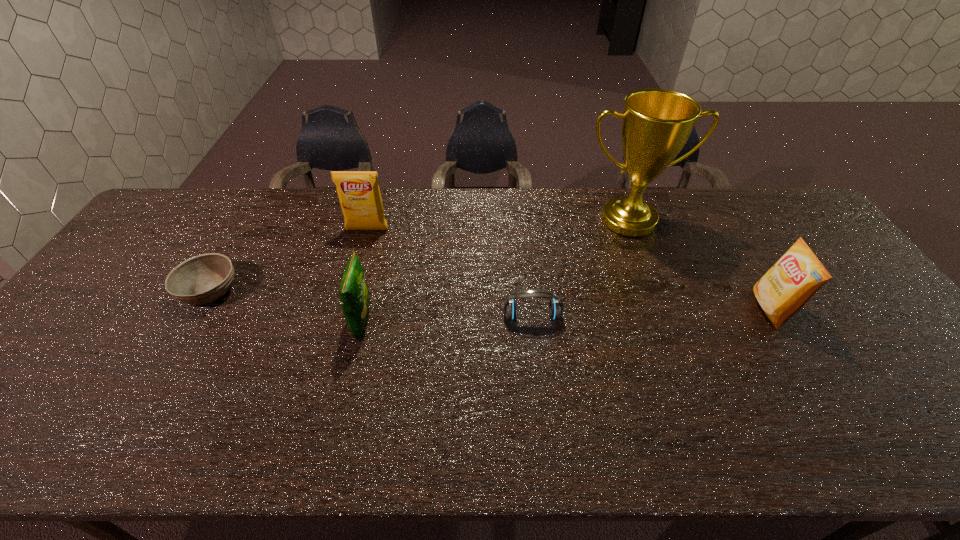
This screenshot has height=540, width=960. Identify the location of vacant space located on the front-facing side of the rightmost crisp (potato chip). (709, 309).

The image size is (960, 540). Identify the location of free space located on the front-facing side of the rightmost crisp (potato chip). (669, 309).

Identify the location of blank space located on the front-facing side of the rightmost crisp (potato chip). (606, 309).

Locate an element on the screen. free space located 0.090m on the ear cups of the third object from right to left is located at coordinates (536, 353).

Find the location of a particular element. The width and height of the screenshot is (960, 540). vacant region located on the back of the bowl is located at coordinates (247, 225).

Find the location of a particular element. award positioned at the far edge is located at coordinates (656, 123).

What are the coordinates of `crisp (potato chip) situated at the far edge` in the screenshot? It's located at (359, 194).

At what (x,y) coordinates should I click in order to perform the action: click on vacant space at the far edge of the desktop. Please return your answer as a coordinate pair (x, y). Looking at the image, I should click on (527, 205).

The height and width of the screenshot is (540, 960). In the image, there is a desktop. Identify the location of free space at the near edge. (354, 433).

Find the location of a particular element. Image resolution: width=960 pixels, height=540 pixels. vacant region at the left edge of the desktop is located at coordinates (164, 269).